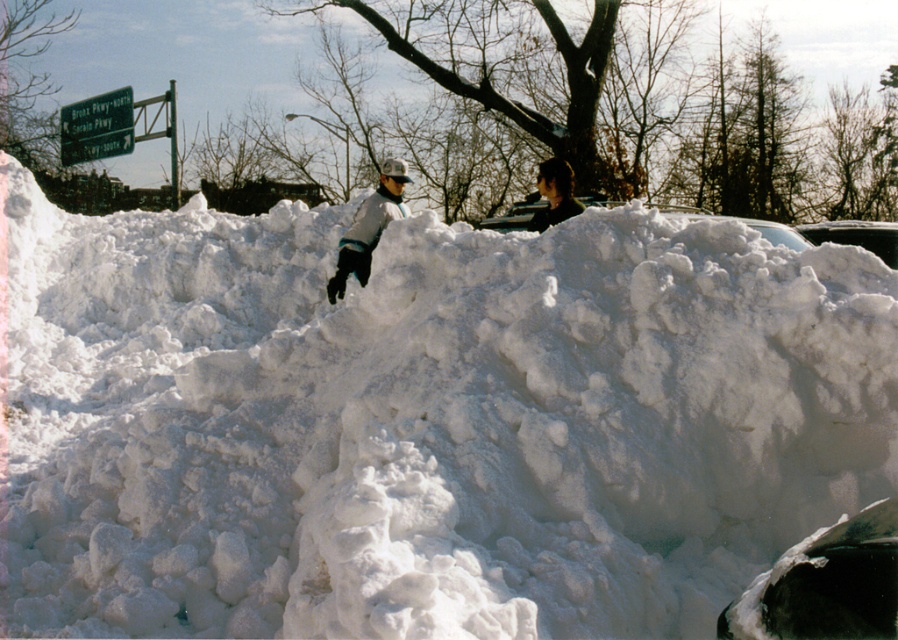
Based on the photo, can you confirm if clear glass car at upper right is positioned above dark brown hair at upper center?

No.

Describe the element at coordinates (856, 236) in the screenshot. I see `clear glass car at upper right` at that location.

Which is behind, point (894, 256) or point (546, 164)?

The point (894, 256) is behind.

The height and width of the screenshot is (640, 898). Find the location of `clear glass car at upper right`. clear glass car at upper right is located at coordinates (856, 236).

Consider the image. Between gray fleece jacket at center and clear glass car at upper right, which one has more height?

gray fleece jacket at center is taller.

Does gray fleece jacket at center appear on the right side of clear glass car at upper right?

No, gray fleece jacket at center is not to the right of clear glass car at upper right.

What do you see at coordinates (368, 227) in the screenshot? I see `gray fleece jacket at center` at bounding box center [368, 227].

What are the coordinates of `gray fleece jacket at center` in the screenshot? It's located at (368, 227).

Is the position of gray fleece jacket at center more distant than that of dark brown hair at upper center?

No, gray fleece jacket at center is in front of dark brown hair at upper center.

Is gray fleece jacket at center taller than dark brown hair at upper center?

Indeed, gray fleece jacket at center has a greater height compared to dark brown hair at upper center.

Is point (361, 228) positioned after point (541, 212)?

No, it is in front of (541, 212).

Find the location of a particular element. This screenshot has height=640, width=898. gray fleece jacket at center is located at coordinates (368, 227).